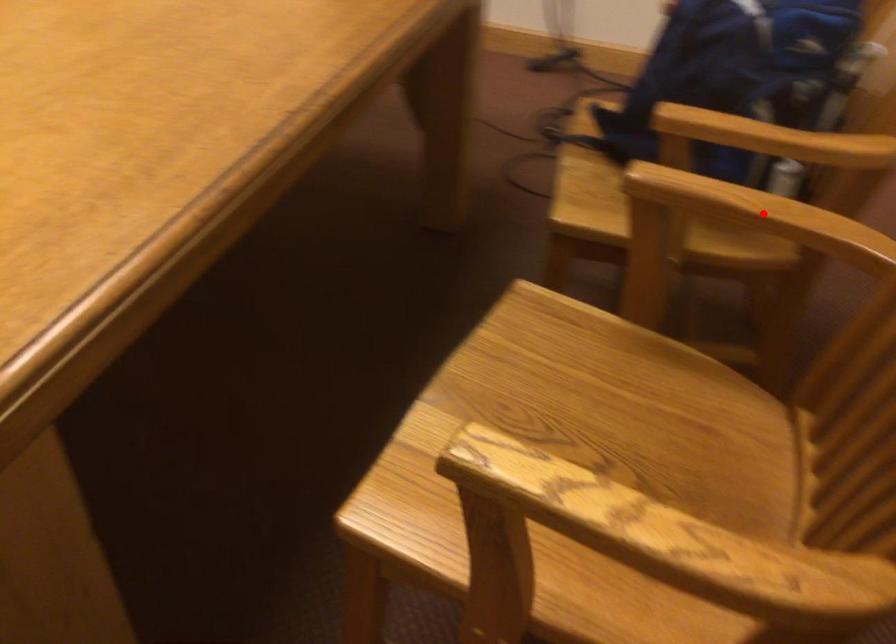
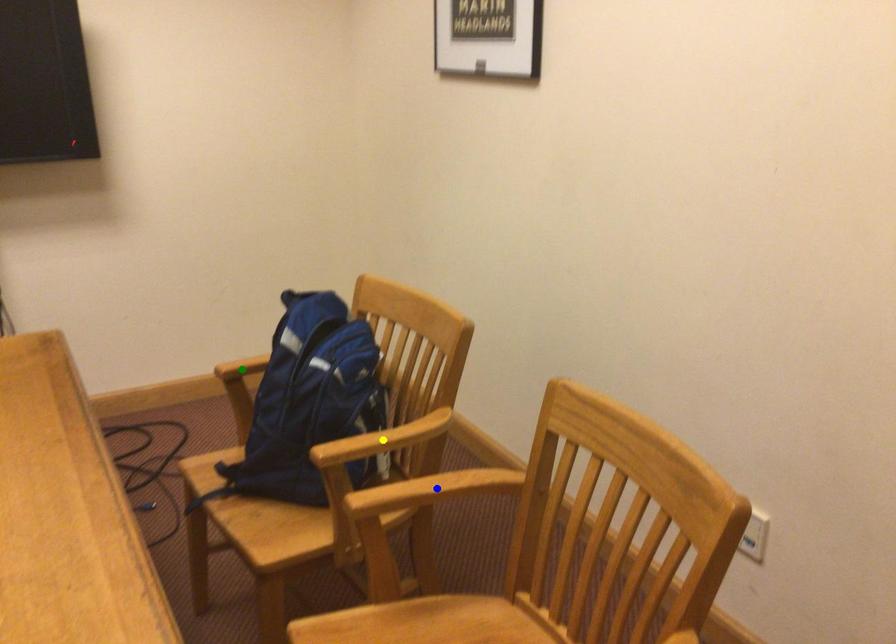
Question: I am providing you with two images of the same scene from different viewpoints. A red point is marked on the first image. You are given multiple points on the second image. Can you choose the point in image 2 that corresponds to the point in image 1?

Choices:
 (A) yellow point
 (B) green point
 (C) blue point

Answer: (C)